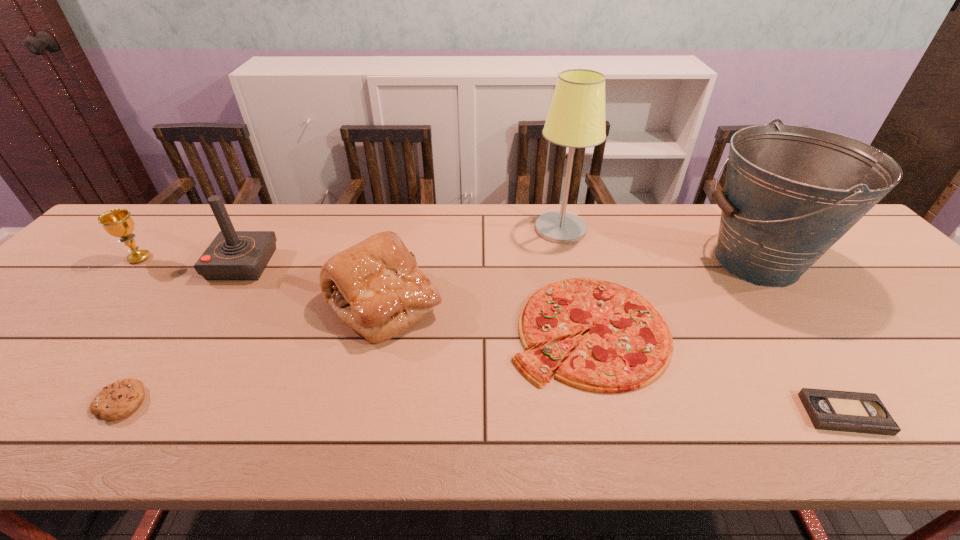
This screenshot has width=960, height=540. Find the location of `empty space that is in between the tallest object and the seventh shortest object`. empty space that is in between the tallest object and the seventh shortest object is located at coordinates (659, 246).

Locate an element on the screen. Image resolution: width=960 pixels, height=540 pixels. vacant space that is in between the tallest object and the fourth object from left to right is located at coordinates (472, 266).

At what (x,y) coordinates should I click in order to perform the action: click on free space between the sixth shortest object and the chalice. Please return your answer as a coordinate pair (x, y). The height and width of the screenshot is (540, 960). Looking at the image, I should click on (191, 261).

Locate an element on the screen. free spot between the videotape and the cookie is located at coordinates (483, 408).

Locate which object is the sixth closest to the tallest object. Please provide its 2D coordinates. Your answer should be formatted as a tuple, i.e. [(x, y)], where the tuple contains the x and y coordinates of a point satisfying the conditions above.

[(119, 399)]

Find the location of `the sixth closest object to the joystick`. the sixth closest object to the joystick is located at coordinates (791, 192).

Where is `vacant space that satisfies the following two spatial constraints: 1. with the handle on opposite sides of the seventh shortest object; 2. on the front side of the shortest object`? The width and height of the screenshot is (960, 540). vacant space that satisfies the following two spatial constraints: 1. with the handle on opposite sides of the seventh shortest object; 2. on the front side of the shortest object is located at coordinates (870, 414).

Image resolution: width=960 pixels, height=540 pixels. Find the location of `vacant space that satisfies the following two spatial constraints: 1. on the filling side of the bread; 2. on the back side of the sixth tallest object`. vacant space that satisfies the following two spatial constraints: 1. on the filling side of the bread; 2. on the back side of the sixth tallest object is located at coordinates (377, 330).